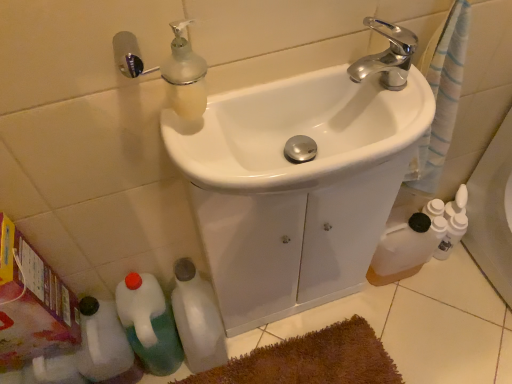
Question: Is white matte bottle at lower left, which is the 1th bottle in right-to-left order, in front of white glossy sink at center, the 2th sink viewed from the front?

Choices:
 (A) yes
 (B) no

Answer: (B)

Question: Can you confirm if white matte bottle at lower left, which is the 3th bottle from left to right, is bigger than white glossy sink at center, the 2th sink viewed from the front?

Choices:
 (A) yes
 (B) no

Answer: (B)

Question: Would you say white glossy sink at center, the 2th sink viewed from the front, is part of white matte bottle at lower left, which is the 1th bottle in right-to-left order,'s contents?

Choices:
 (A) yes
 (B) no

Answer: (B)

Question: Is white matte bottle at lower left, which is the 1th bottle in right-to-left order, smaller than white glossy sink at center, the 2th sink viewed from the front?

Choices:
 (A) no
 (B) yes

Answer: (B)

Question: Is white matte bottle at lower left, which is the 3th bottle from left to right, positioned beyond the bounds of white glossy sink at center, the 2th sink viewed from the front?

Choices:
 (A) yes
 (B) no

Answer: (A)

Question: Considering the positions of brown plush bath mat at lower center and green plastic bottle at lower left, which is the second bottle from right to left, in the image, is brown plush bath mat at lower center bigger or smaller than green plastic bottle at lower left, which is the second bottle from right to left,?

Choices:
 (A) big
 (B) small

Answer: (B)

Question: Visually, is brown plush bath mat at lower center positioned to the left or to the right of green plastic bottle at lower left, which is the second bottle from right to left?

Choices:
 (A) left
 (B) right

Answer: (B)

Question: From the image's perspective, relative to green plastic bottle at lower left, the second bottle viewed from the left, is brown plush bath mat at lower center above or below?

Choices:
 (A) above
 (B) below

Answer: (B)

Question: From a real-world perspective, is brown plush bath mat at lower center physically located above or below green plastic bottle at lower left, which is the second bottle from right to left?

Choices:
 (A) below
 (B) above

Answer: (A)

Question: From the image's perspective, is white glossy sink at center, positioned as the first sink in front-to-back order, located above or below white matte bottle at lower left, which is the 3th bottle from left to right?

Choices:
 (A) above
 (B) below

Answer: (A)

Question: From a real-world perspective, is white glossy sink at center, positioned as the first sink in front-to-back order, positioned above or below white matte bottle at lower left, which is the 1th bottle in right-to-left order?

Choices:
 (A) above
 (B) below

Answer: (A)

Question: Choose the correct answer: Is white glossy sink at center, the 2th sink viewed from the back, inside white matte bottle at lower left, which is the 1th bottle in right-to-left order, or outside it?

Choices:
 (A) inside
 (B) outside

Answer: (B)

Question: Considering the positions of white glossy sink at center, positioned as the first sink in front-to-back order, and white matte bottle at lower left, which is the 3th bottle from left to right, in the image, is white glossy sink at center, positioned as the first sink in front-to-back order, taller or shorter than white matte bottle at lower left, which is the 3th bottle from left to right,?

Choices:
 (A) tall
 (B) short

Answer: (B)

Question: Is white matte bottle at lower left, which is the 1th bottle in right-to-left order, to the left or to the right of brown plush bath mat at lower center in the image?

Choices:
 (A) right
 (B) left

Answer: (B)

Question: From the image's perspective, is white matte bottle at lower left, which is the 3th bottle from left to right, positioned above or below brown plush bath mat at lower center?

Choices:
 (A) above
 (B) below

Answer: (A)